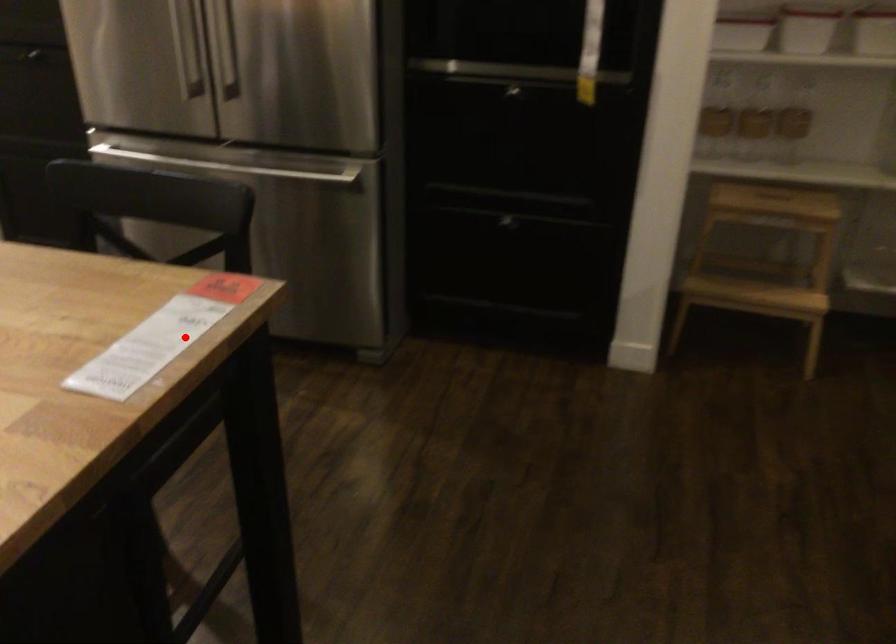
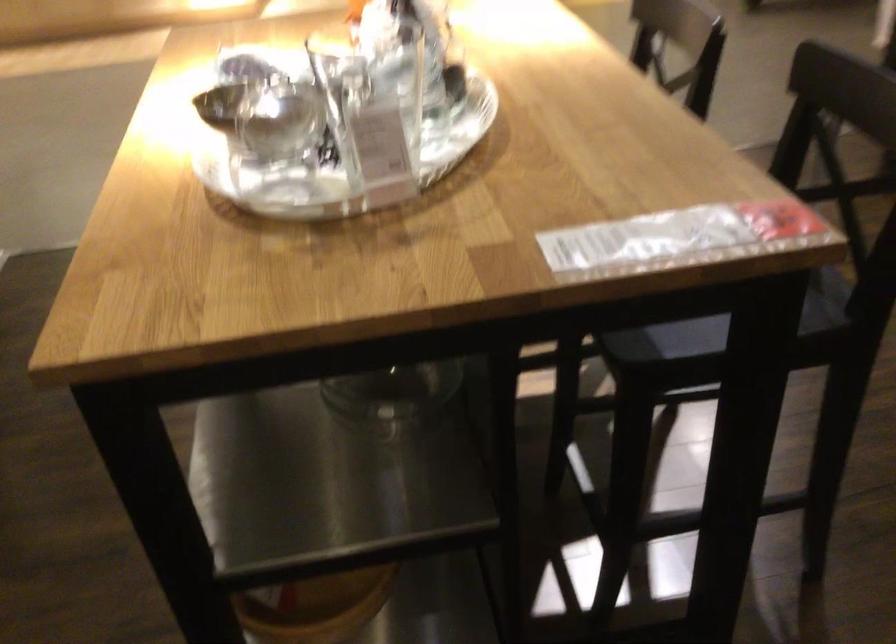
In the second image, find the point that corresponds to the highlighted location in the first image.

(676, 238)